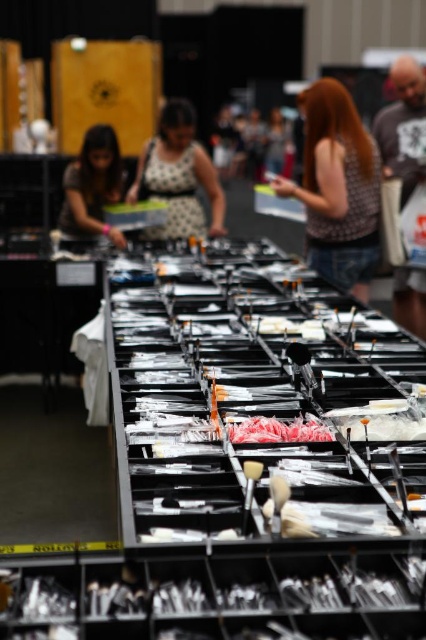
From the picture: You are a customer at a clothing store and see the plaid shirt at upper center and the polka dot dress at center. Which item is taller?

The plaid shirt at upper center is much taller than the polka dot dress at center.

You are a customer at a convention booth and see the polka dot dress at center and the matte black laptop at left. Which item is positioned higher in the image?

The polka dot dress at center is located above the matte black laptop at left, so it is positioned higher in the image.

You are a customer at a trade show and you see the polka dot dress at center and the matte black laptop at left. Which item is taller?

The polka dot dress at center is taller than the matte black laptop at left.